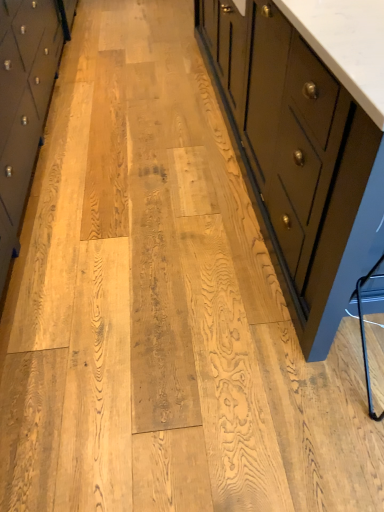
Question: From the image's perspective, is matte black cabinet at right, which is the second chest of drawers in left-to-right order, on matte black cabinet at left, acting as the 2th chest of drawers starting from the right?

Choices:
 (A) no
 (B) yes

Answer: (B)

Question: Is matte black cabinet at left, acting as the 2th chest of drawers starting from the right, located within matte black cabinet at right, the first chest of drawers when ordered from right to left?

Choices:
 (A) no
 (B) yes

Answer: (A)

Question: Can you confirm if matte black cabinet at right, the first chest of drawers when ordered from right to left, is shorter than matte black cabinet at left, the first chest of drawers in the left-to-right sequence?

Choices:
 (A) yes
 (B) no

Answer: (B)

Question: From a real-world perspective, is matte black cabinet at right, which is the second chest of drawers in left-to-right order, on top of matte black cabinet at left, acting as the 2th chest of drawers starting from the right?

Choices:
 (A) no
 (B) yes

Answer: (B)

Question: Could you tell me if matte black cabinet at right, which is the second chest of drawers in left-to-right order, is facing matte black cabinet at left, the first chest of drawers in the left-to-right sequence?

Choices:
 (A) no
 (B) yes

Answer: (A)

Question: Are matte black cabinet at right, which is the second chest of drawers in left-to-right order, and matte black cabinet at left, the first chest of drawers in the left-to-right sequence, located far from each other?

Choices:
 (A) no
 (B) yes

Answer: (B)

Question: Is matte black cabinet at left, acting as the 2th chest of drawers starting from the right, in contact with matte black cabinet at right, which is the second chest of drawers in left-to-right order?

Choices:
 (A) yes
 (B) no

Answer: (B)

Question: Is matte black cabinet at left, the first chest of drawers in the left-to-right sequence, further to camera compared to matte black cabinet at right, which is the second chest of drawers in left-to-right order?

Choices:
 (A) yes
 (B) no

Answer: (A)

Question: Is matte black cabinet at left, acting as the 2th chest of drawers starting from the right, smaller than matte black cabinet at right, which is the second chest of drawers in left-to-right order?

Choices:
 (A) no
 (B) yes

Answer: (B)

Question: Is matte black cabinet at right, the first chest of drawers when ordered from right to left, a part of matte black cabinet at left, acting as the 2th chest of drawers starting from the right?

Choices:
 (A) yes
 (B) no

Answer: (B)

Question: From the image's perspective, is matte black cabinet at left, acting as the 2th chest of drawers starting from the right, located beneath matte black cabinet at right, the first chest of drawers when ordered from right to left?

Choices:
 (A) no
 (B) yes

Answer: (B)

Question: Is matte black cabinet at left, acting as the 2th chest of drawers starting from the right, taller than matte black cabinet at right, the first chest of drawers when ordered from right to left?

Choices:
 (A) no
 (B) yes

Answer: (A)

Question: Looking at the image, does matte black cabinet at right, which is the second chest of drawers in left-to-right order, seem bigger or smaller compared to matte black cabinet at left, acting as the 2th chest of drawers starting from the right?

Choices:
 (A) big
 (B) small

Answer: (A)